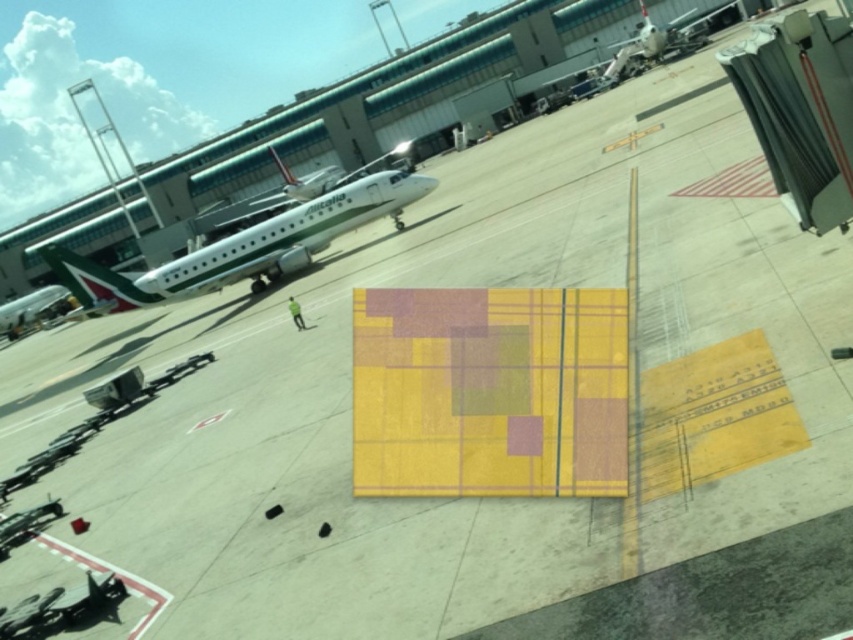
You are a ground crew member who needs to move a 20 meter long equipment truck between the white glossy airplane at upper center and the white glossy airplane at upper right. Is there enough space for the truck to pass through the gap between them?

The distance between the white glossy airplane at upper center and the white glossy airplane at upper right is 23.26 meters. Since the equipment truck is 20 meters long, there is sufficient space for it to pass through the gap between them.

You are standing at the airport tarmac and want to locate the point marked at coordinates (659, 42). Based on the scene description, which airplane should you look for?

The point marked at coordinates (659, 42) is on the white glossy airplane at upper right.